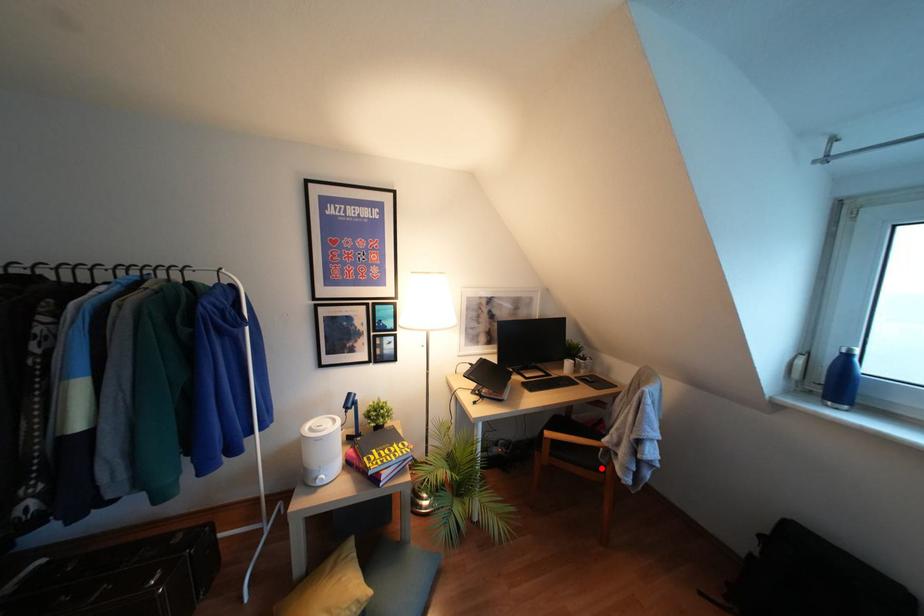
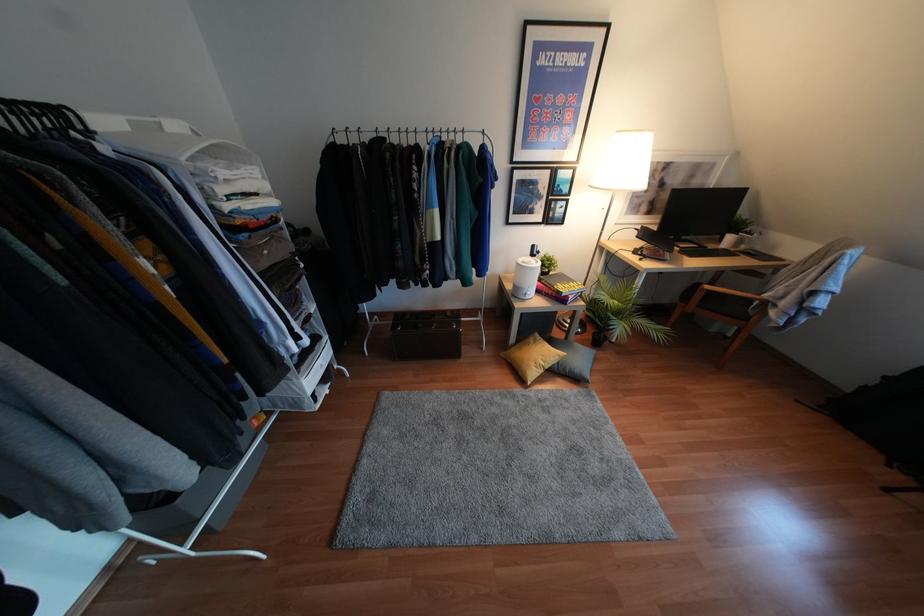
Question: A red point is marked in image1. In image2, is the corresponding 3D point closer to the camera or farther? Reply with the corresponding letter.

Choices:
 (A) The corresponding 3D point is closer.
 (B) The corresponding 3D point is farther.

Answer: (A)